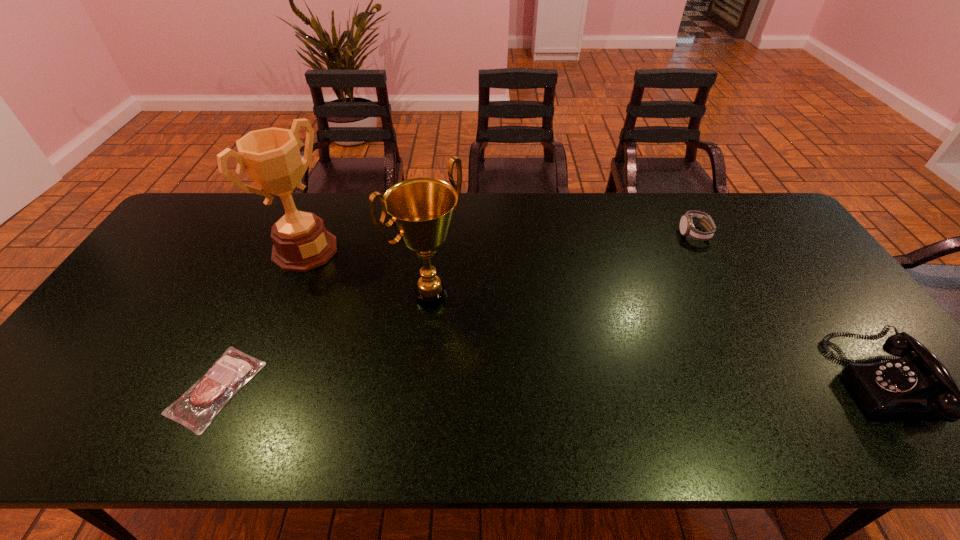
Find the location of a particular element. This screenshot has width=960, height=540. free space located on the front-facing side of the left award is located at coordinates (335, 273).

Find the location of a particular element. This screenshot has height=540, width=960. free space located 0.150m on the front-facing side of the left award is located at coordinates (356, 288).

The image size is (960, 540). Identify the location of vacant area located 0.370m on the front view with handles of the right award. point(557,404).

This screenshot has height=540, width=960. What are the coordinates of `vacant space situated 0.180m on the front view with handles of the right award` in the screenshot? It's located at (499, 353).

The image size is (960, 540). Identify the location of vacant space situated on the front view with handles of the right award. (550, 398).

Where is `watch at the far edge`? watch at the far edge is located at coordinates (687, 229).

This screenshot has width=960, height=540. I want to click on award located in the far edge section of the desktop, so click(x=271, y=156).

At what (x,y) coordinates should I click in order to perform the action: click on object that is at the near edge. Please return your answer as a coordinate pair (x, y). This screenshot has height=540, width=960. Looking at the image, I should click on (197, 407).

In the image, there is a desktop. Find the location of `vacant space at the far edge`. vacant space at the far edge is located at coordinates (344, 223).

I want to click on vacant area at the left edge, so click(140, 334).